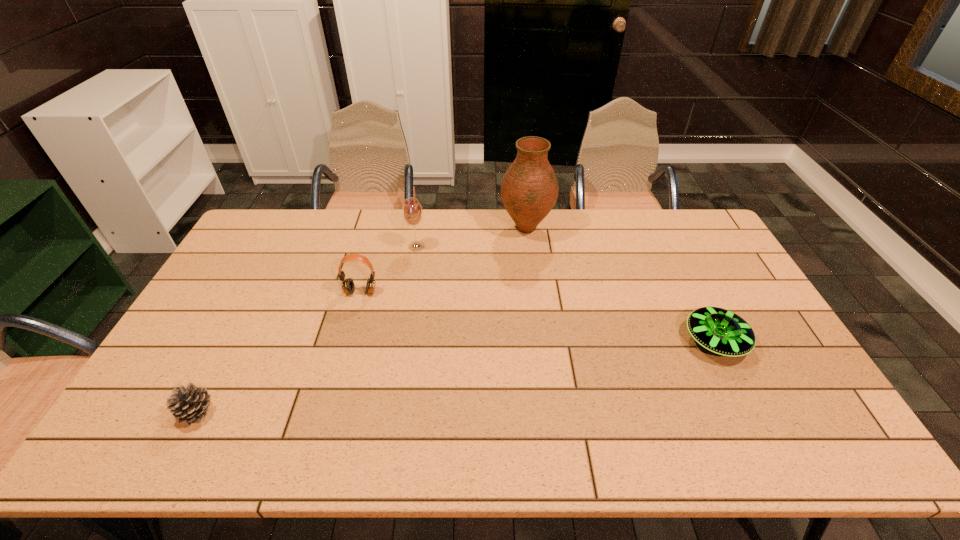
The height and width of the screenshot is (540, 960). Identify the location of vacant area that lies between the wineglass and the nearest object. (307, 329).

This screenshot has width=960, height=540. Find the location of `free point between the third farthest object and the leftmost object`. free point between the third farthest object and the leftmost object is located at coordinates (278, 352).

Find the location of a particular element. This screenshot has height=540, width=960. vacant space in between the wineglass and the third nearest object is located at coordinates (389, 269).

Identify the location of vacant space that's between the vase and the third nearest object. (444, 260).

At what (x,y) coordinates should I click in order to perform the action: click on vacant area between the leftmost object and the third nearest object. Please return your answer as a coordinate pair (x, y). Looking at the image, I should click on (278, 352).

You are a GUI agent. You are given a task and a screenshot of the screen. Output one action in this format:
    pyautogui.click(x=<x>, y=<y>)
    Task: Click on the free space between the second tallest object and the tallest object
    
    Given the screenshot: What is the action you would take?
    pyautogui.click(x=471, y=238)

Locate an element on the screen. free space that is in between the third farthest object and the third object from left to right is located at coordinates (389, 269).

Identify which object is the fourth nearest to the vase. Please provide its 2D coordinates. Your answer should be formatted as a tuple, i.e. [(x, y)], where the tuple contains the x and y coordinates of a point satisfying the conditions above.

[(190, 404)]

This screenshot has height=540, width=960. I want to click on object that is the second closest to the rightmost object, so click(412, 212).

Where is `free space that satisfies the following two spatial constraints: 1. on the ear cups of the third tallest object; 2. on the right side of the saucer`? This screenshot has width=960, height=540. free space that satisfies the following two spatial constraints: 1. on the ear cups of the third tallest object; 2. on the right side of the saucer is located at coordinates (348, 341).